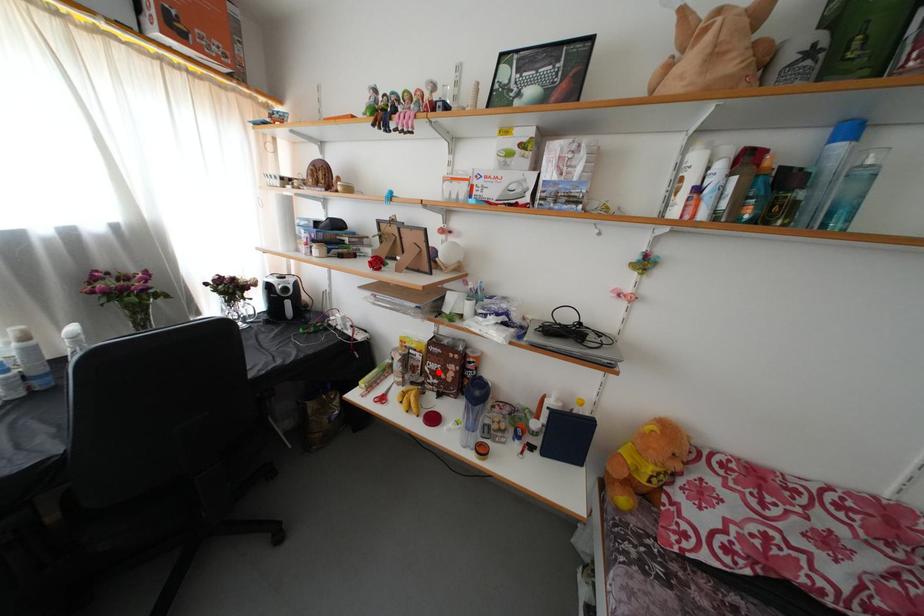
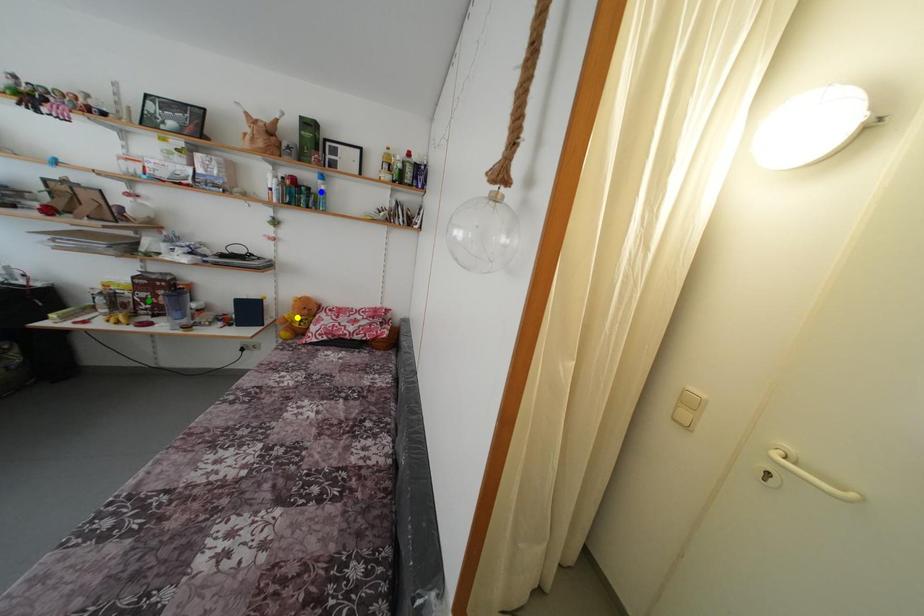
Question: I am providing you with two images of the same scene from different viewpoints. A red point is marked on the first image. You are given multiple points on the second image. Which point in image 2 represents the same 3d spot as the red point in image 1?

Choices:
 (A) green point
 (B) yellow point
 (C) blue point

Answer: (A)